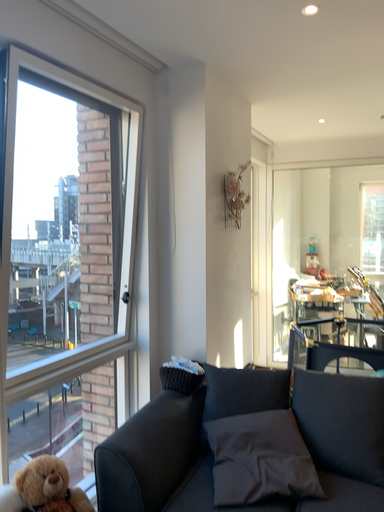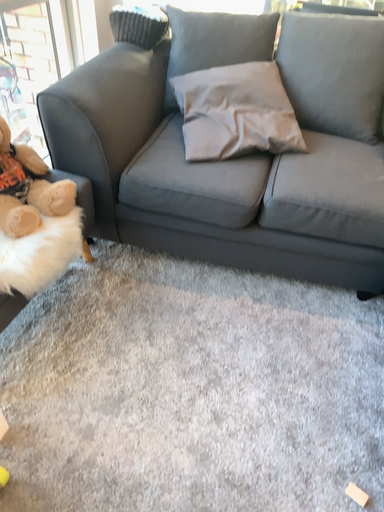
Question: How did the camera likely rotate when shooting the video?

Choices:
 (A) rotated downward
 (B) rotated upward

Answer: (A)